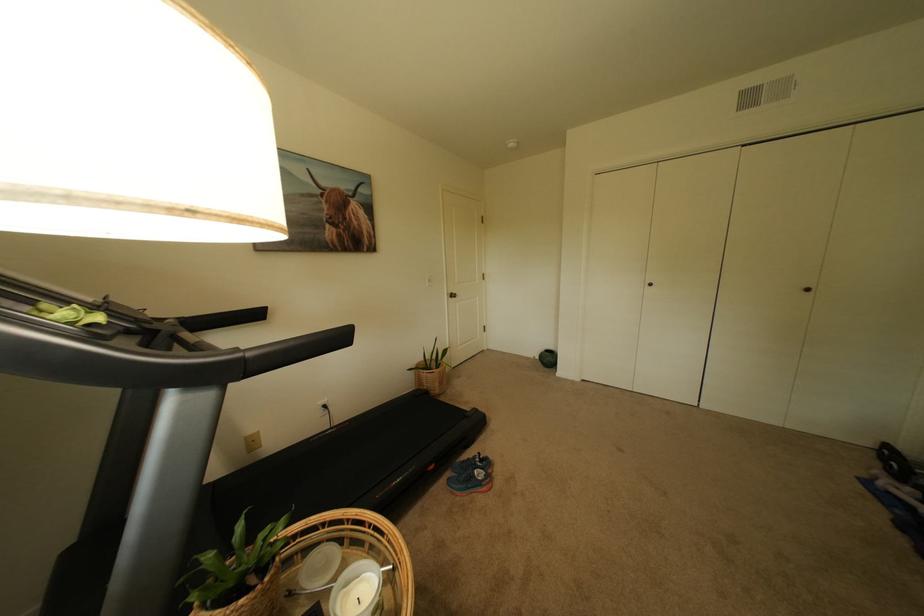
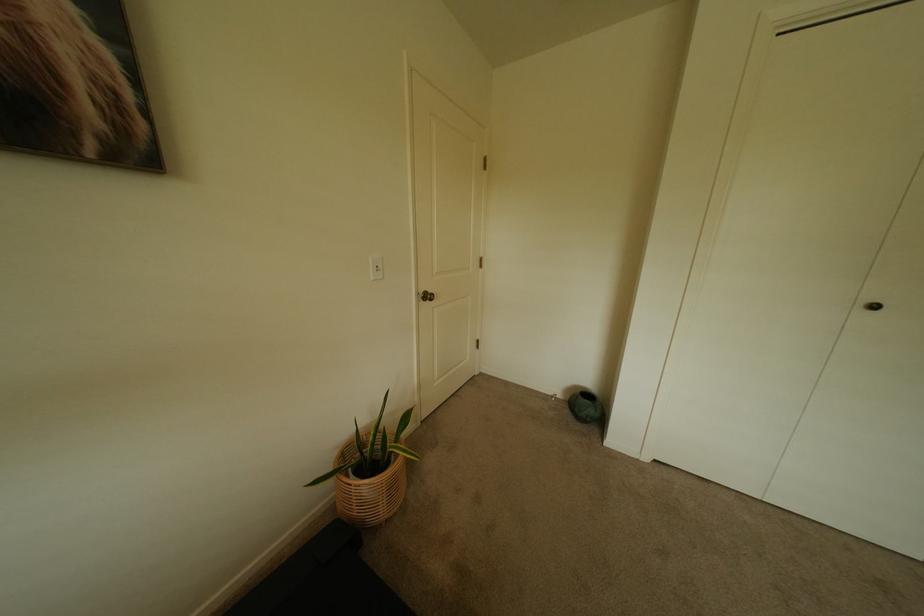
Question: Which direction would the cameraman need to move to produce the second image? Reply with the corresponding letter.

Choices:
 (A) Left
 (B) Right
 (C) Forward
 (D) Backward

Answer: (C)